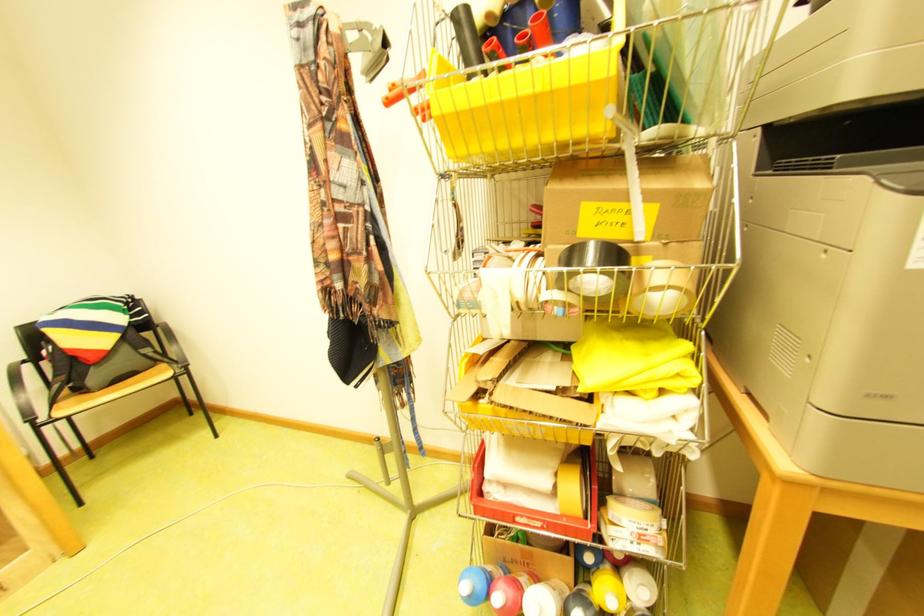
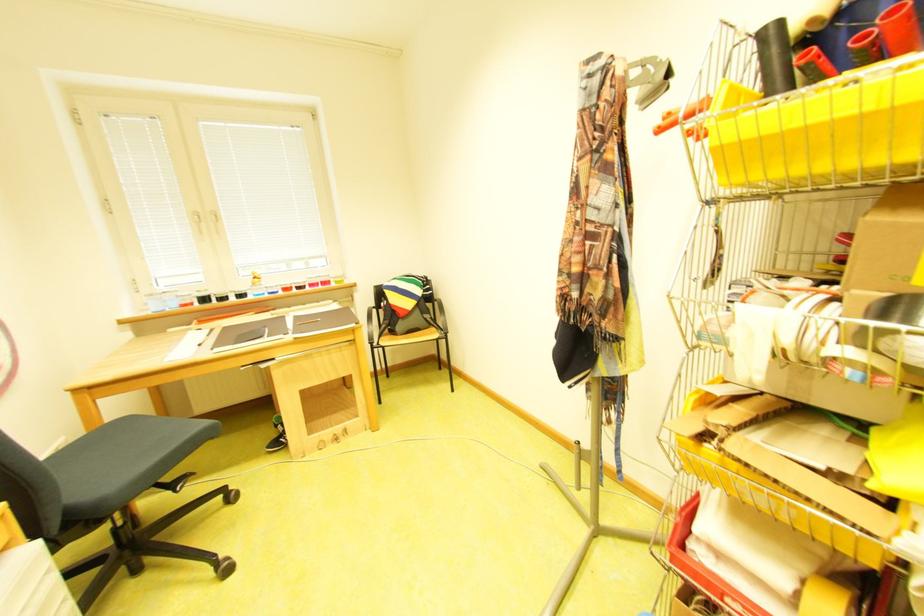
Where in the second image is the point corresponding to (x=397, y=100) from the first image?

(672, 128)